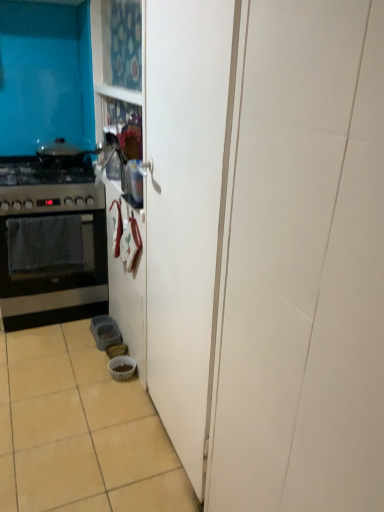
Question: Can you confirm if black matte oven at left is bigger than stainless steel oven at left?

Choices:
 (A) yes
 (B) no

Answer: (B)

Question: Does black matte oven at left turn towards stainless steel oven at left?

Choices:
 (A) yes
 (B) no

Answer: (B)

Question: Can you confirm if black matte oven at left is shorter than stainless steel oven at left?

Choices:
 (A) yes
 (B) no

Answer: (A)

Question: Does black matte oven at left contain stainless steel oven at left?

Choices:
 (A) yes
 (B) no

Answer: (B)

Question: Considering the relative sizes of black matte oven at left and stainless steel oven at left in the image provided, is black matte oven at left thinner than stainless steel oven at left?

Choices:
 (A) no
 (B) yes

Answer: (B)

Question: Considering the relative positions of black matte oven at left and stainless steel oven at left in the image provided, is black matte oven at left to the right of stainless steel oven at left from the viewer's perspective?

Choices:
 (A) yes
 (B) no

Answer: (A)

Question: Is black matte gas stove at left looking in the opposite direction of white glossy bowl at lower center?

Choices:
 (A) yes
 (B) no

Answer: (B)

Question: Could you tell me if black matte gas stove at left is facing white glossy bowl at lower center?

Choices:
 (A) yes
 (B) no

Answer: (B)

Question: Considering the relative sizes of black matte gas stove at left and white glossy bowl at lower center in the image provided, is black matte gas stove at left wider than white glossy bowl at lower center?

Choices:
 (A) no
 (B) yes

Answer: (B)

Question: Is black matte gas stove at left behind white glossy bowl at lower center?

Choices:
 (A) no
 (B) yes

Answer: (B)

Question: Is black matte gas stove at left not close to white glossy bowl at lower center?

Choices:
 (A) yes
 (B) no

Answer: (A)

Question: From the image's perspective, would you say black matte gas stove at left is shown under white glossy bowl at lower center?

Choices:
 (A) no
 (B) yes

Answer: (A)

Question: From a real-world perspective, is white glossy bowl at lower center under beige ceramic tile at lower left?

Choices:
 (A) yes
 (B) no

Answer: (B)